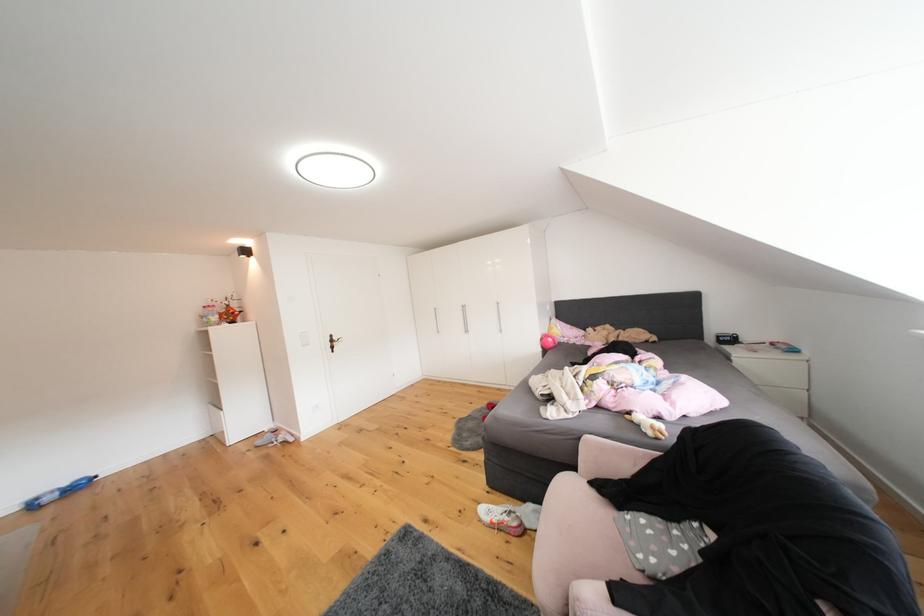
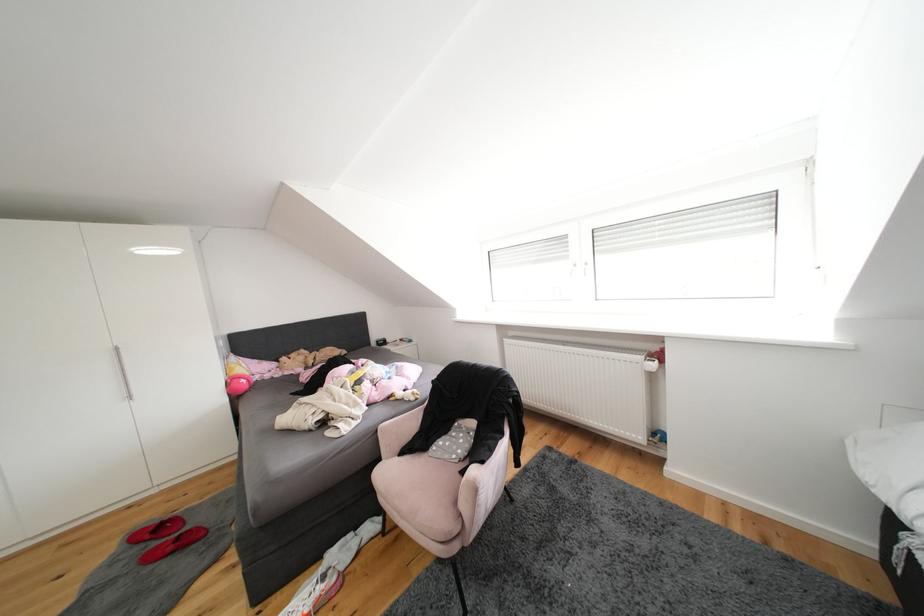
Where in the second image is the point corresponding to (496,415) from the first image?

(146, 553)